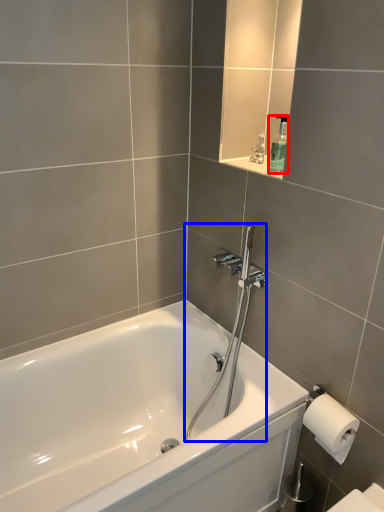
Question: Among these objects, which one is nearest to the camera, soap dispenser (highlighted by a red box) or shower (highlighted by a blue box)?

Choices:
 (A) soap dispenser
 (B) shower

Answer: (B)